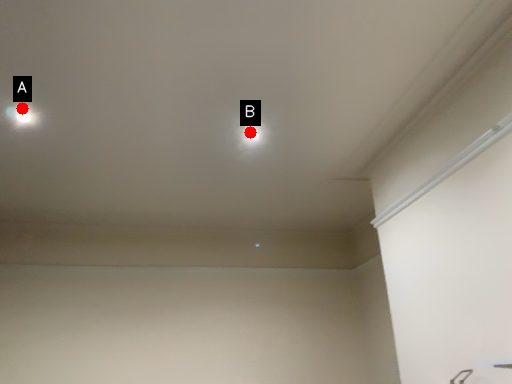
Question: Two points are circled on the image, labeled by A and B beside each circle. Which point is closer to the camera?

Choices:
 (A) A is closer
 (B) B is closer

Answer: (A)